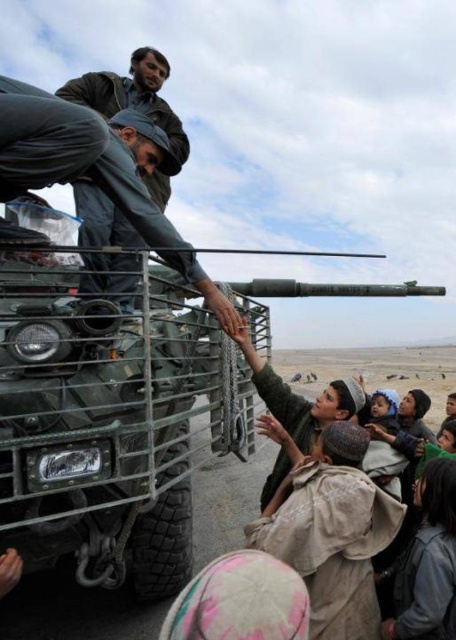
Question: Which point is closer to the camera taking this photo?

Choices:
 (A) (25, 307)
 (B) (0, 166)
 (C) (118, 104)

Answer: (B)

Question: In this image, where is green matte tank at lower left located relative to dark green uniform at upper left?

Choices:
 (A) below
 (B) above

Answer: (A)

Question: Does green matte tank at lower left appear on the left side of dark green uniform at upper left?

Choices:
 (A) no
 (B) yes

Answer: (A)

Question: From the image, what is the correct spatial relationship of green matte tank at lower left in relation to dark green uniform at upper left?

Choices:
 (A) right
 (B) left

Answer: (A)

Question: Which object is the closest to the matte green uniform at left?

Choices:
 (A) green matte tank at lower left
 (B) dark green uniform at upper left

Answer: (A)

Question: Estimate the real-world distances between objects in this image. Which object is closer to the dark green uniform at upper left?

Choices:
 (A) matte green uniform at left
 (B) green matte tank at lower left

Answer: (A)